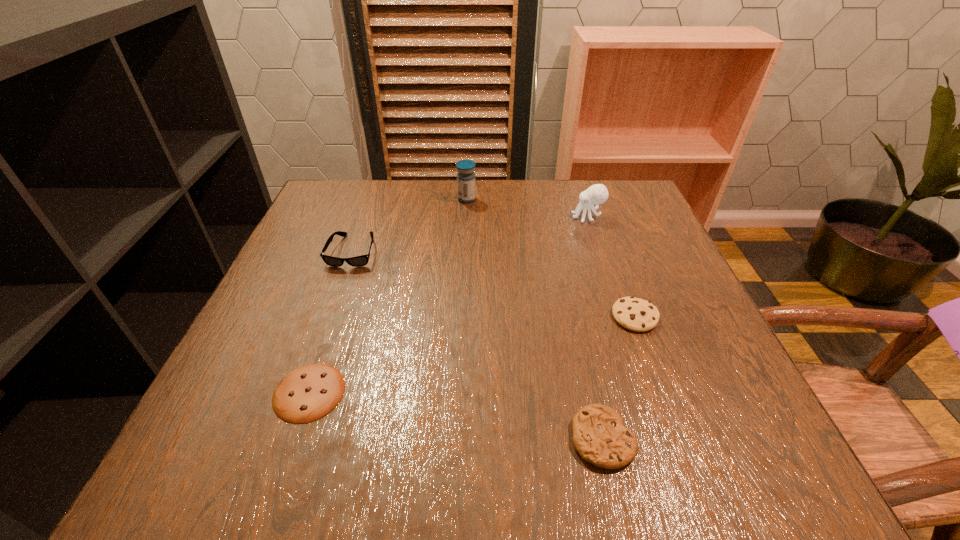
Locate an element on the screen. The height and width of the screenshot is (540, 960). vacant space at the near left corner is located at coordinates (203, 431).

This screenshot has width=960, height=540. What are the coordinates of `free space at the far right corner of the desktop` in the screenshot? It's located at (612, 183).

Where is `free region at the near right corner of the desktop`? The height and width of the screenshot is (540, 960). free region at the near right corner of the desktop is located at coordinates (731, 425).

Locate an element on the screen. The image size is (960, 540). empty space that is in between the shortest object and the second farthest object is located at coordinates (448, 305).

Locate an element on the screen. This screenshot has width=960, height=540. free space that is in between the fifth nearest object and the third farthest object is located at coordinates (470, 234).

This screenshot has height=540, width=960. Identify the location of vacant area that lies between the sunglasses and the second cookie from left to right. (478, 345).

Locate an element on the screen. vacant space in between the fifth nearest object and the rightmost cookie is located at coordinates (612, 267).

The width and height of the screenshot is (960, 540). In order to click on free space between the leftmost cookie and the fourth object from left to right in this screenshot , I will do `click(456, 415)`.

The width and height of the screenshot is (960, 540). Identify the location of free space between the third object from right to left and the shortest cookie. (456, 415).

Where is `free space between the shortest cookie and the third farthest object`? Image resolution: width=960 pixels, height=540 pixels. free space between the shortest cookie and the third farthest object is located at coordinates (331, 322).